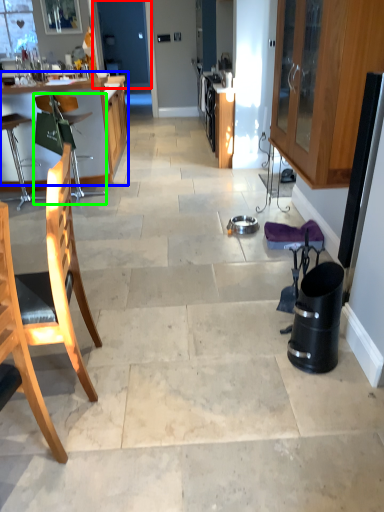
Question: Which object is the closest to the screen door (highlighted by a red box)? Choose among these: table (highlighted by a blue box) or chair (highlighted by a green box).

Choices:
 (A) table
 (B) chair

Answer: (A)